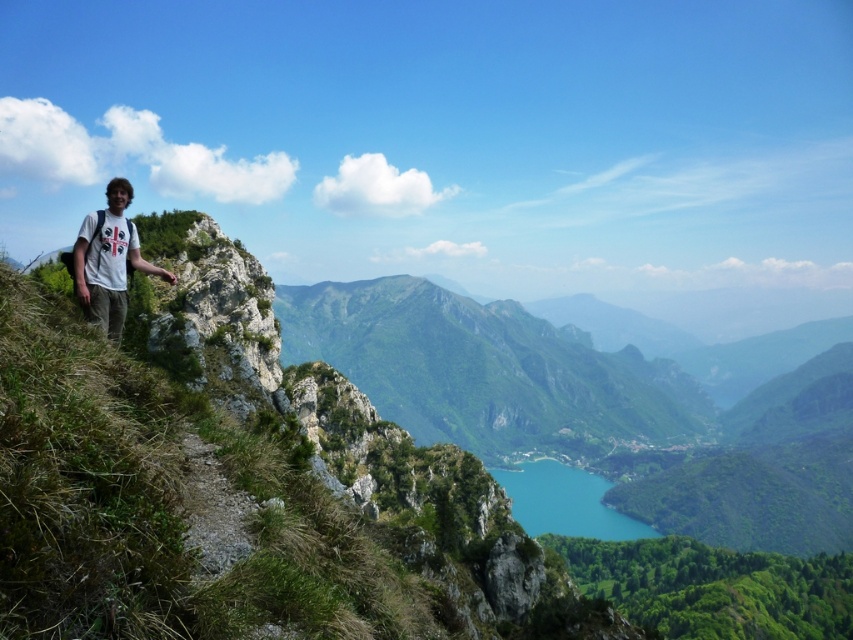
Is turquoise glassy lake at center wider than white cotton shirt at upper left?

Yes, turquoise glassy lake at center is wider than white cotton shirt at upper left.

The width and height of the screenshot is (853, 640). What do you see at coordinates (566, 500) in the screenshot? I see `turquoise glassy lake at center` at bounding box center [566, 500].

Between point (579, 522) and point (94, 243), which one is positioned in front?

Positioned in front is point (94, 243).

Find the location of `turquoise glassy lake at center`. turquoise glassy lake at center is located at coordinates (566, 500).